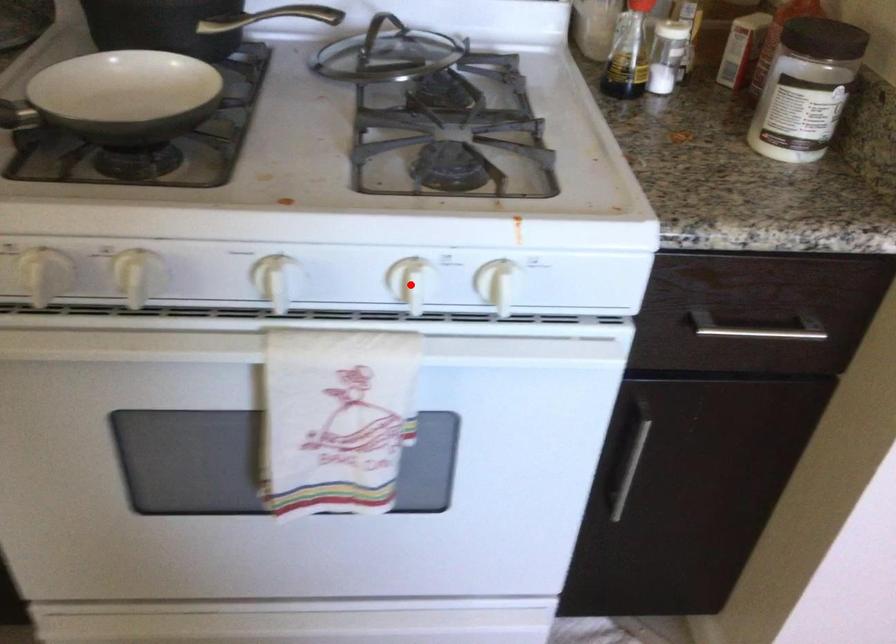
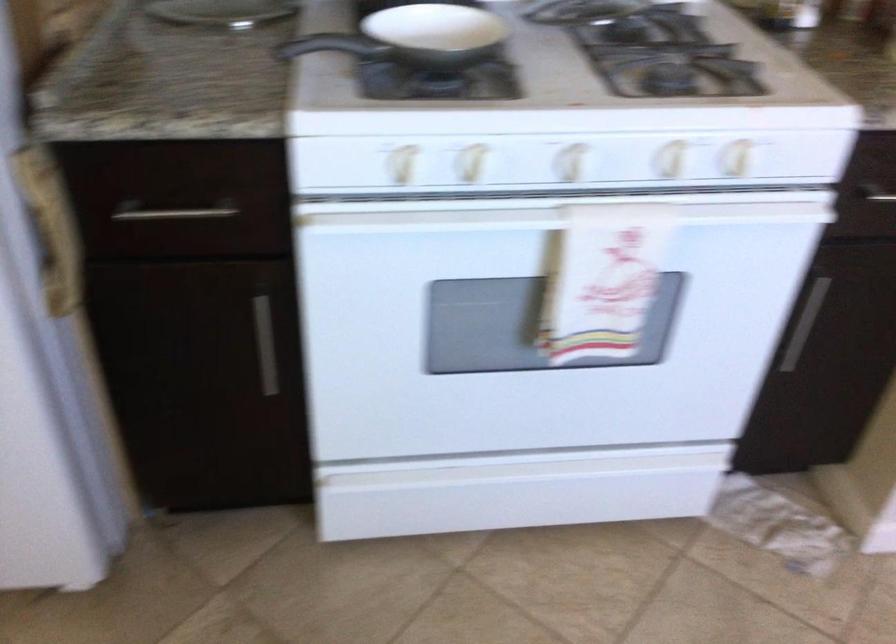
Question: I am providing you with two images of the same scene from different viewpoints. Given a red point in image1, look at the same physical point in image2. Is it:

Choices:
 (A) Closer to the viewpoint
 (B) Farther from the viewpoint

Answer: (B)